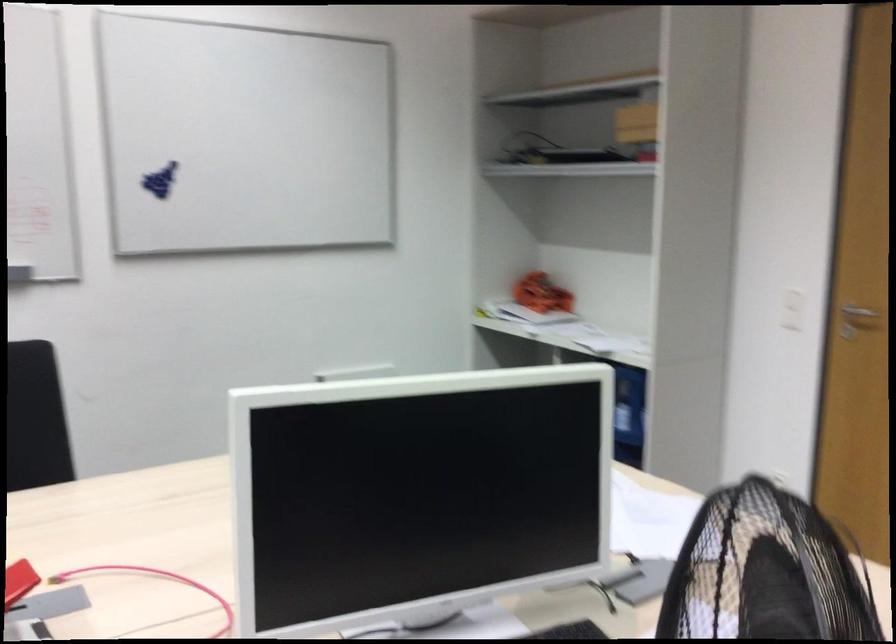
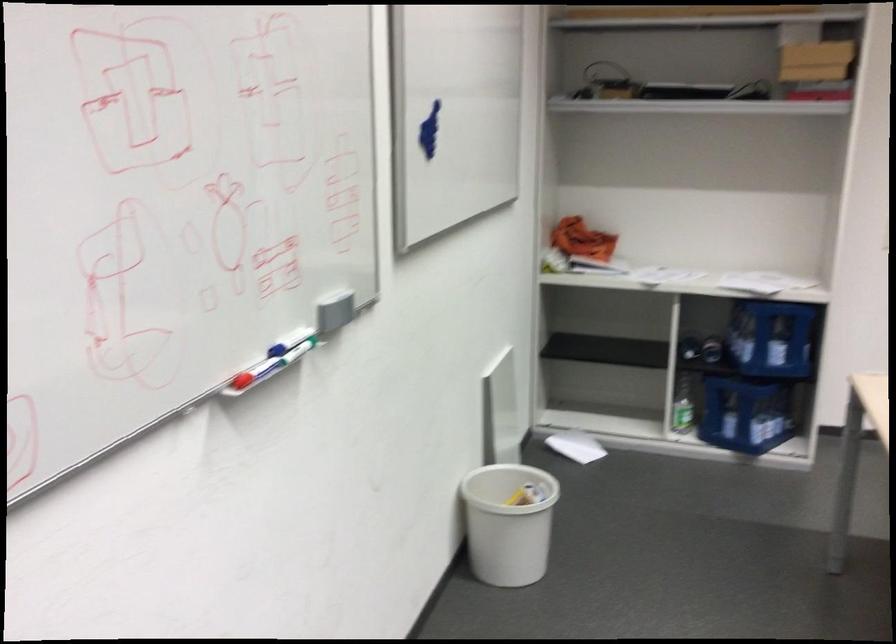
The point at (675, 393) is marked in the first image. Where is the corresponding point in the second image?

(771, 337)